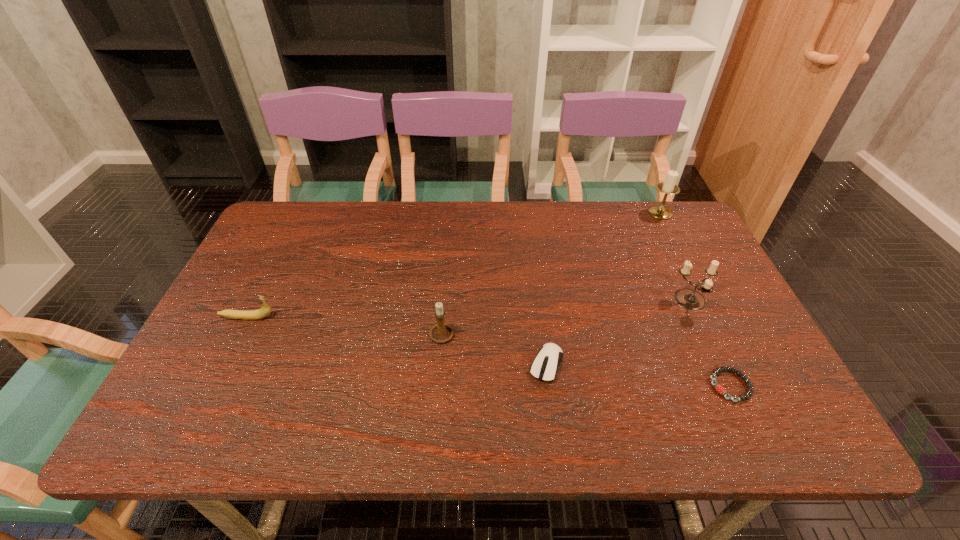
Select which candle holder appears as the closest to the fifth object from right to left. Please provide its 2D coordinates. Your answer should be formatted as a tuple, i.e. [(x, y)], where the tuple contains the x and y coordinates of a point satisfying the conditions above.

[(689, 299)]

Locate an element on the screen. The width and height of the screenshot is (960, 540). free space that satisfies the following two spatial constraints: 1. at the stem of the banana; 2. on the right side of the bracelet is located at coordinates (213, 386).

Where is `vacant position in the image that satisfies the following two spatial constraints: 1. on the side of the third nearest object with the handle; 2. on the back side of the second shortest object`? The height and width of the screenshot is (540, 960). vacant position in the image that satisfies the following two spatial constraints: 1. on the side of the third nearest object with the handle; 2. on the back side of the second shortest object is located at coordinates (443, 364).

The width and height of the screenshot is (960, 540). In order to click on vacant point that satisfies the following two spatial constraints: 1. on the front side of the second nearest candle holder; 2. on the side of the fourth farthest object with the handle in this screenshot , I will do `click(707, 335)`.

The height and width of the screenshot is (540, 960). Identify the location of vacant space that satisfies the following two spatial constraints: 1. on the side of the nearest candle holder with the handle; 2. on the right side of the second shortest object. (443, 364).

This screenshot has width=960, height=540. I want to click on free space that satisfies the following two spatial constraints: 1. on the side of the nearest candle holder with the handle; 2. on the right side of the third object from left to right, so click(x=443, y=364).

Identify the location of free space that satisfies the following two spatial constraints: 1. at the stem of the fourth tallest object; 2. on the right side of the bracelet. The height and width of the screenshot is (540, 960). (213, 386).